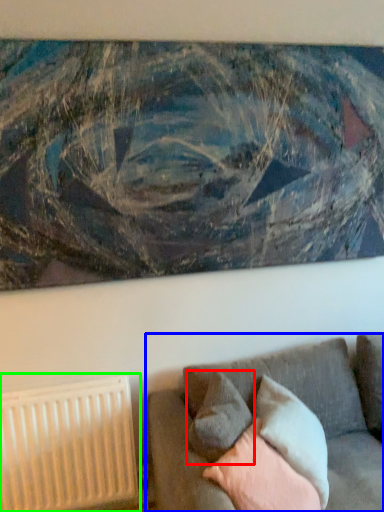
Question: Which object is the closest to the pillow (highlighted by a red box)? Choose among these: studio couch (highlighted by a blue box) or radiator (highlighted by a green box).

Choices:
 (A) studio couch
 (B) radiator

Answer: (A)